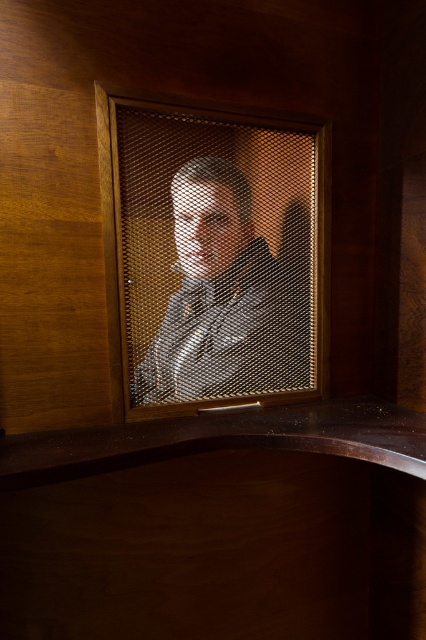
Question: Which point is farther from the camera taking this photo?

Choices:
 (A) (298, 385)
 (B) (126, 128)

Answer: (A)

Question: Does metal mesh at center have a greater width compared to matte black shirt at center?

Choices:
 (A) no
 (B) yes

Answer: (B)

Question: In this image, where is metal mesh at center located relative to matte black shirt at center?

Choices:
 (A) left
 (B) right

Answer: (A)

Question: From the image, what is the correct spatial relationship of metal mesh at center in relation to matte black shirt at center?

Choices:
 (A) left
 (B) right

Answer: (A)

Question: Which point is closer to the camera?

Choices:
 (A) (224, 298)
 (B) (221, 307)

Answer: (A)